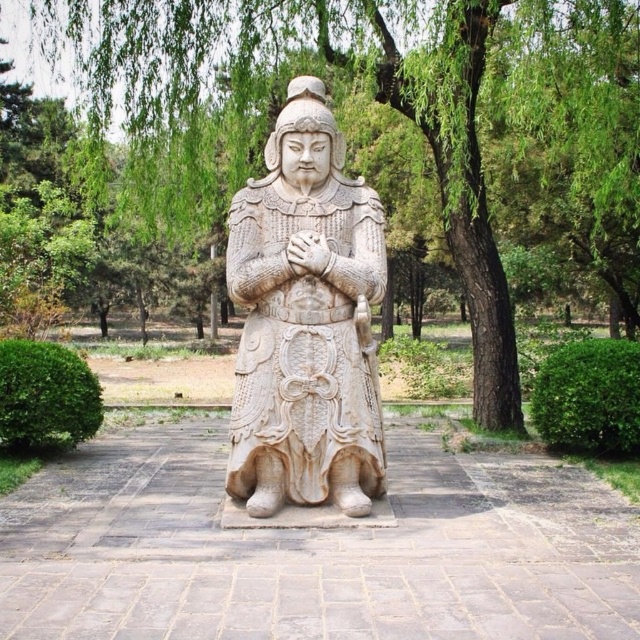
Question: Among these objects, which one is nearest to the camera?

Choices:
 (A) white stone statue at center
 (B) green leafy tree at center

Answer: (A)

Question: From the image, what is the correct spatial relationship of green leafy tree at center in relation to white stone statue at center?

Choices:
 (A) left
 (B) right

Answer: (B)

Question: Is green leafy tree at center to the right of white stone statue at center from the viewer's perspective?

Choices:
 (A) no
 (B) yes

Answer: (B)

Question: Is green leafy tree at center wider than white stone statue at center?

Choices:
 (A) no
 (B) yes

Answer: (A)

Question: Which of the following is the farthest from the observer?

Choices:
 (A) (305, 481)
 (B) (625, 161)

Answer: (B)